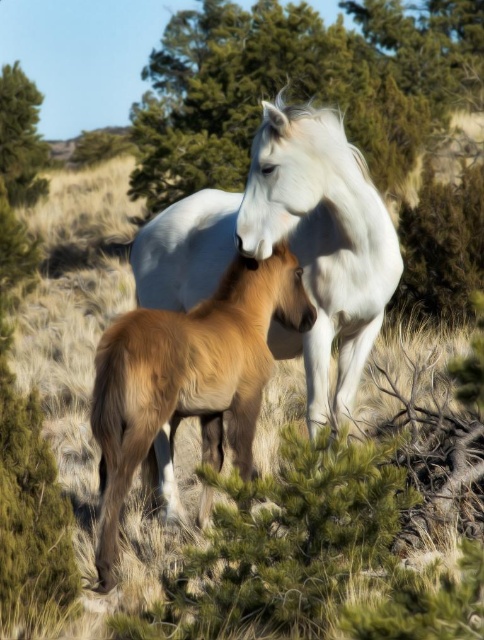
Is point (248, 115) positioned behind point (243, 413)?

Yes, it is.

The height and width of the screenshot is (640, 484). Identify the location of green leafy tree at upper center. (299, 84).

Does point (318, 333) come farther from viewer compared to point (24, 147)?

That is False.

Who is shorter, white glossy horse at center or green leafy tree at upper left?

Standing shorter between the two is white glossy horse at center.

Locate an element on the screen. This screenshot has width=484, height=640. white glossy horse at center is located at coordinates (288, 243).

Who is taller, brown fuzzy foal at center or green leafy tree at upper left?

green leafy tree at upper left is taller.

Is point (236, 285) farther from viewer compared to point (38, 170)?

No, (236, 285) is closer to viewer.

Identify the location of brown fuzzy foal at center. (187, 378).